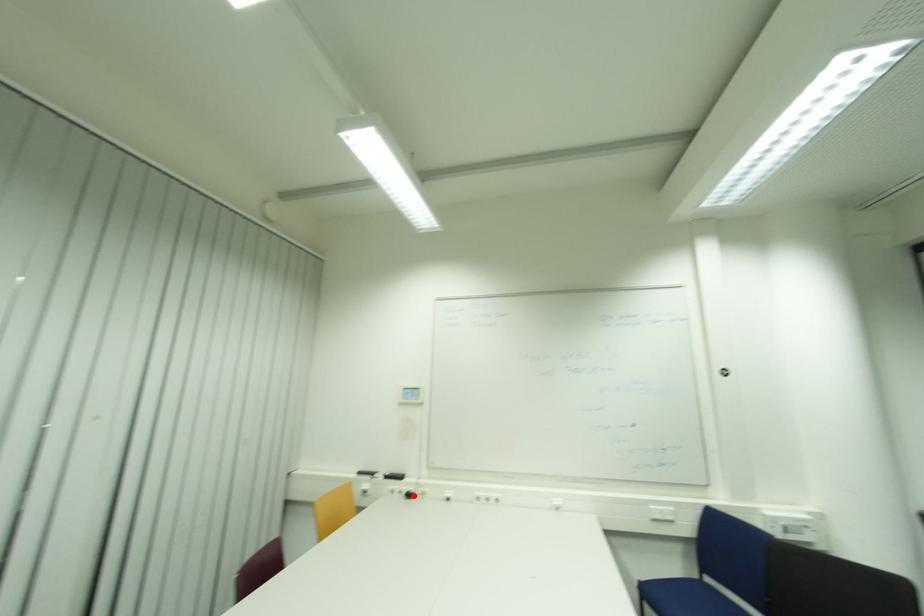
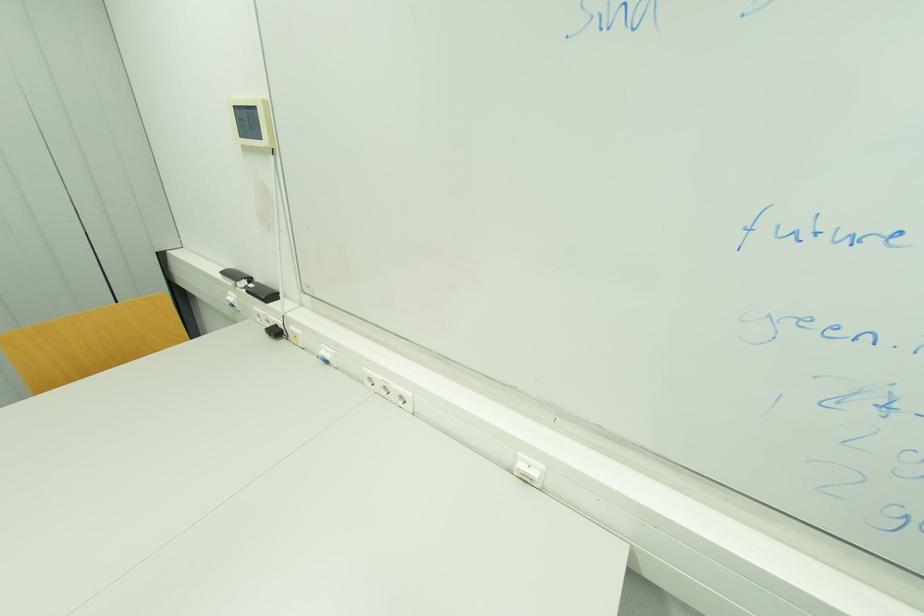
In the second image, find the point that corresponds to the highlighted location in the first image.

(281, 333)